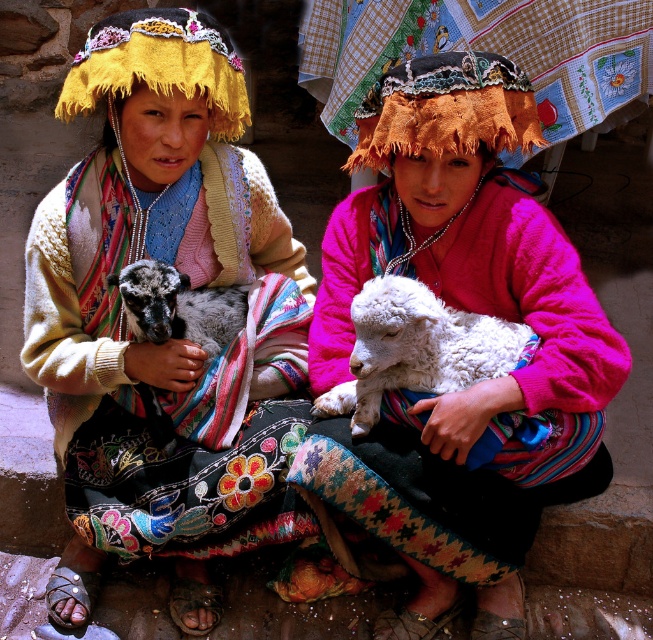
You are a photographer trying to capture a closeup of the white woolen lamb at center and the yellow knitted headdress at upper left in the scene. Since you can only focus on one object at a time, which one should you choose to ensure the other remains in the background?

The white woolen lamb at center is to the right of the yellow knitted headdress at upper left, so focusing on the yellow knitted headdress at upper left would place the white woolen lamb at center in the background.

Looking at this image, you are a photographer trying to capture a closeup of the matte woolen sweater at center. You are currently standing at the point marked as point (x=163, y=340). Can you move directly towards the sweater without any obstructions?

Yes, since the matte woolen sweater at center is located exactly at point (x=163, y=340) where you are currently standing, you can easily capture the closeup without any obstructions.

You are a photographer trying to capture a closeup shot of the matte woolen sweater at center and the white fluffy lamb at center. Since your camera can only focus on one subject at a time, which object should you choose to ensure the one with greater height is in focus?

The matte woolen sweater at center has a greater height compared to the white fluffy lamb at center, so you should focus on the matte woolen sweater at center to ensure the taller object is in focus.